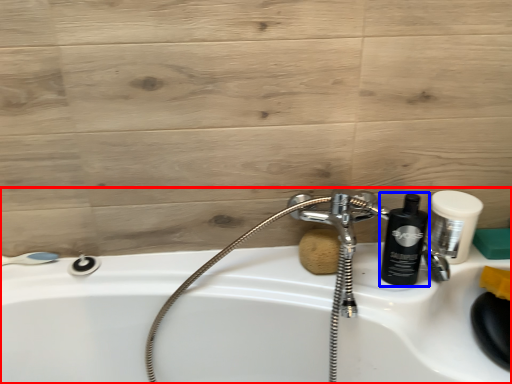
Question: Which object appears farthest to the camera in this image, sink (highlighted by a red box) or shaving cream (highlighted by a blue box)?

Choices:
 (A) sink
 (B) shaving cream

Answer: (B)